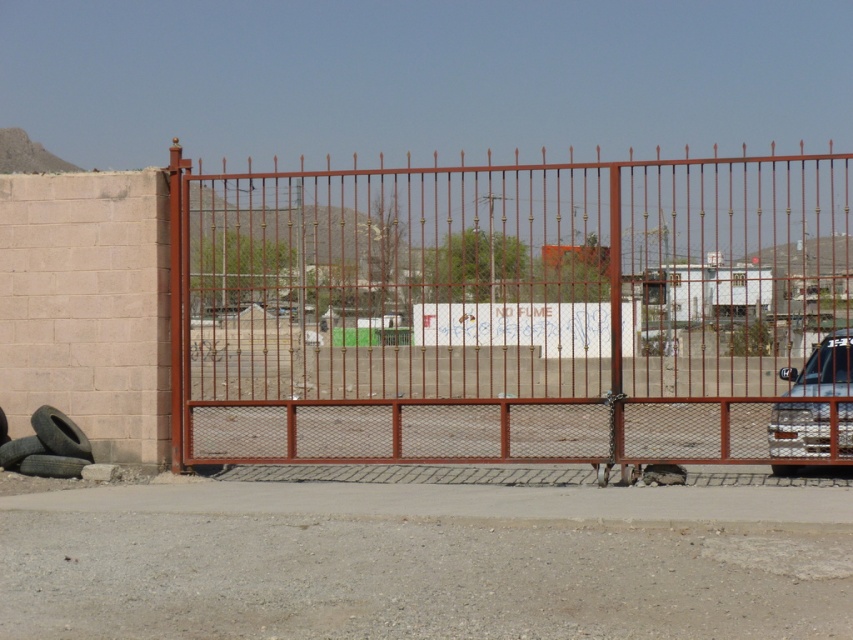
Question: Which is nearer to the rusty metal gate at center?

Choices:
 (A) dark gray rubber tire at lower left
 (B) metallic silver car at right

Answer: (A)

Question: Which point is farther to the camera?

Choices:
 (A) (759, 436)
 (B) (772, 429)
 (C) (41, 406)
 (D) (35, 444)

Answer: (B)

Question: Which of these objects is positioned farthest from the metallic silver car at right?

Choices:
 (A) black rubber tire at lower left
 (B) rusty metal gate at center

Answer: (B)

Question: Does rusty metal gate at center appear over metallic silver car at right?

Choices:
 (A) no
 (B) yes

Answer: (B)

Question: Is metallic silver car at right smaller than dark gray rubber tire at lower left?

Choices:
 (A) yes
 (B) no

Answer: (B)

Question: Does rusty metal gate at center have a smaller size compared to black rubber tire at lower left?

Choices:
 (A) no
 (B) yes

Answer: (A)